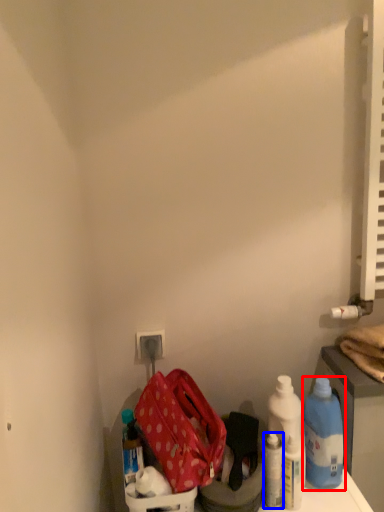
Question: Which point is closer to the camera, bottle (highlighted by a red box) or bottle (highlighted by a blue box)?

Choices:
 (A) bottle
 (B) bottle

Answer: (B)